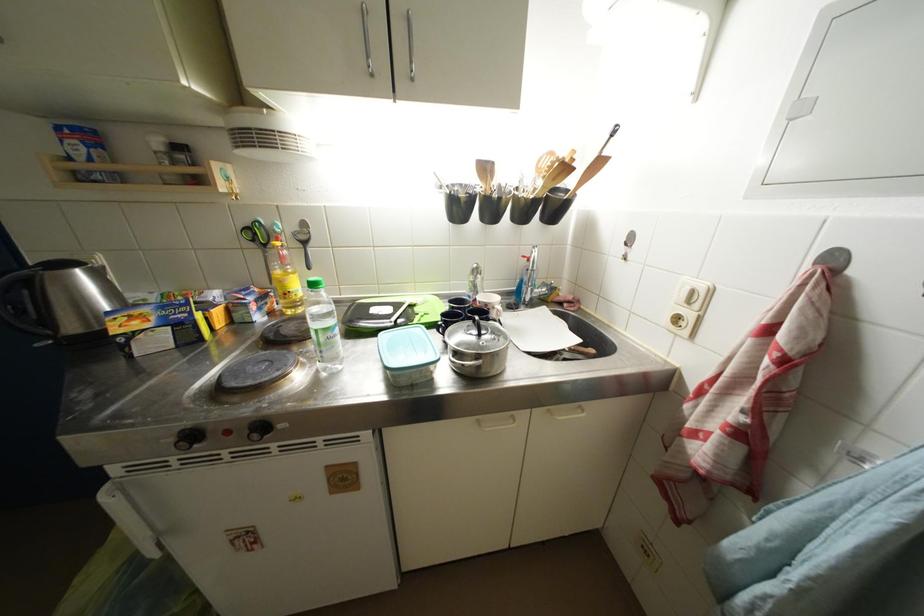
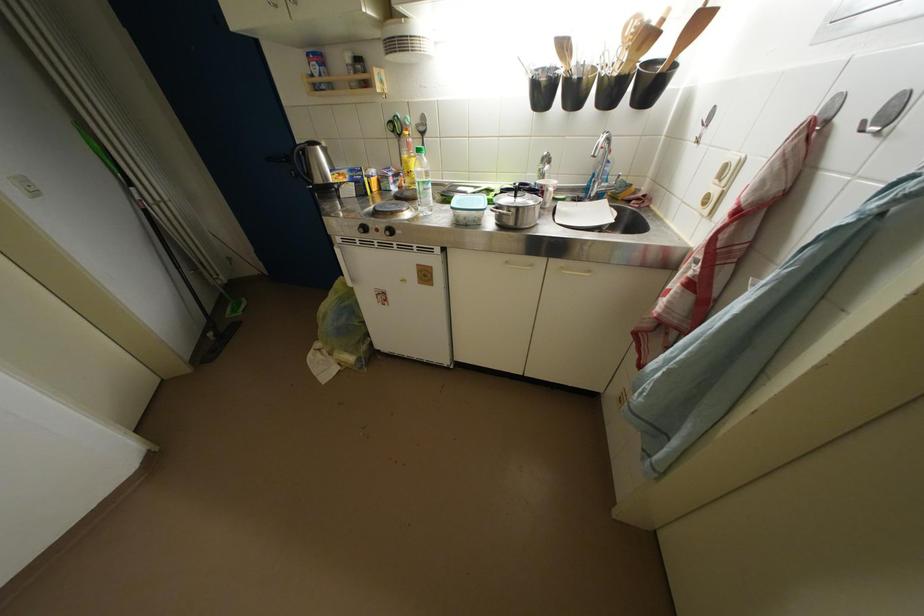
Locate, in the second image, the point that corresponds to pixel 418 310 in the first image.

(495, 193)